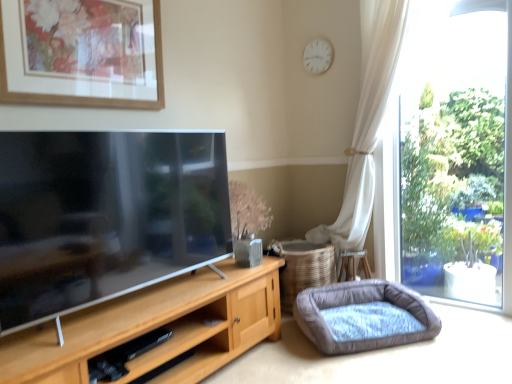
Question: Looking at the image, does white matte clock at upper center seem bigger or smaller compared to matte wooden picture frame at upper left?

Choices:
 (A) big
 (B) small

Answer: (B)

Question: Based on their positions, is white matte clock at upper center located to the left or right of matte wooden picture frame at upper left?

Choices:
 (A) right
 (B) left

Answer: (A)

Question: Estimate the real-world distances between objects in this image. Which object is farther from the velvet grey dog bed at lower right?

Choices:
 (A) matte wooden picture frame at upper left
 (B) white matte clock at upper center

Answer: (B)

Question: Which object is positioned farthest from the white matte clock at upper center?

Choices:
 (A) velvet grey dog bed at lower right
 (B) matte wooden picture frame at upper left

Answer: (A)